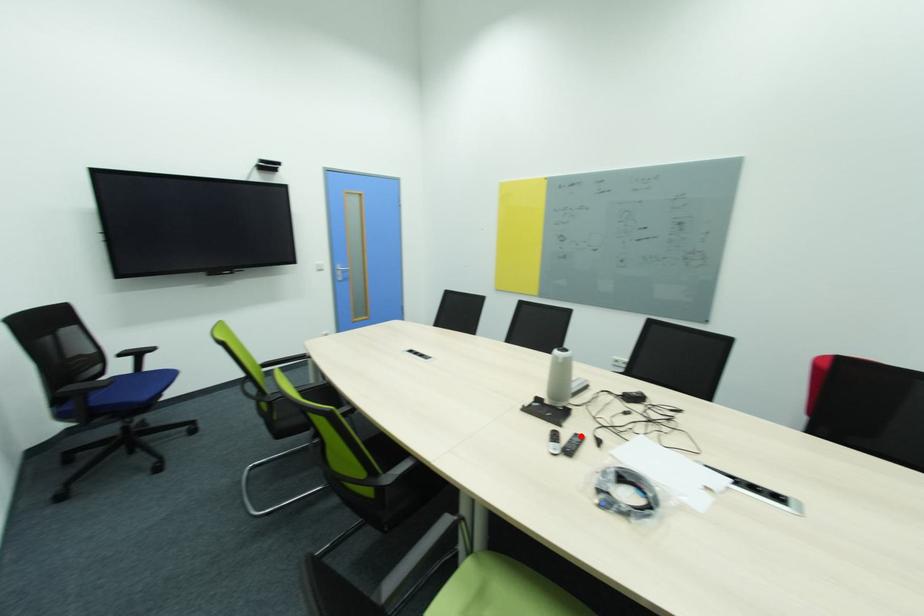
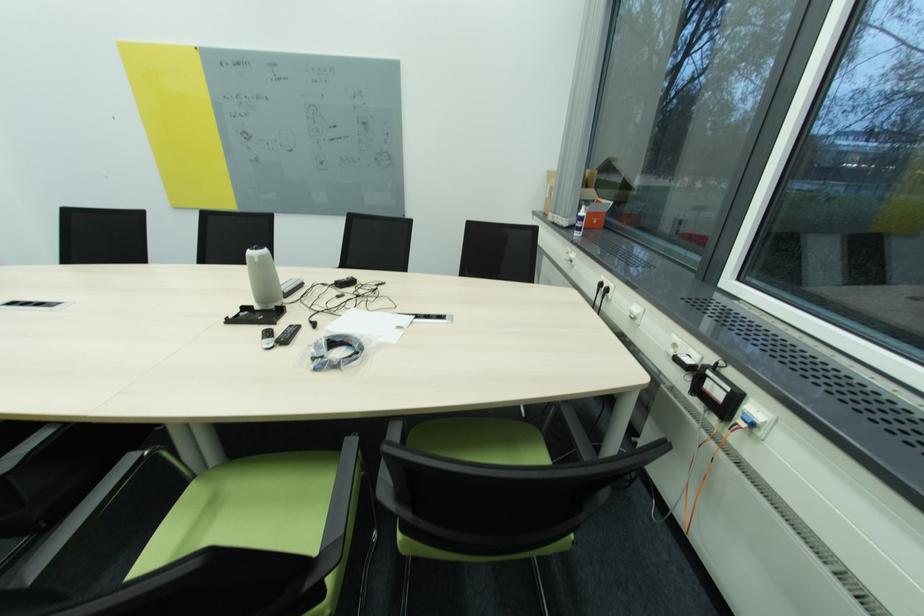
Where in the second image is the point corresponding to the highlighted location from the first image?

(296, 328)